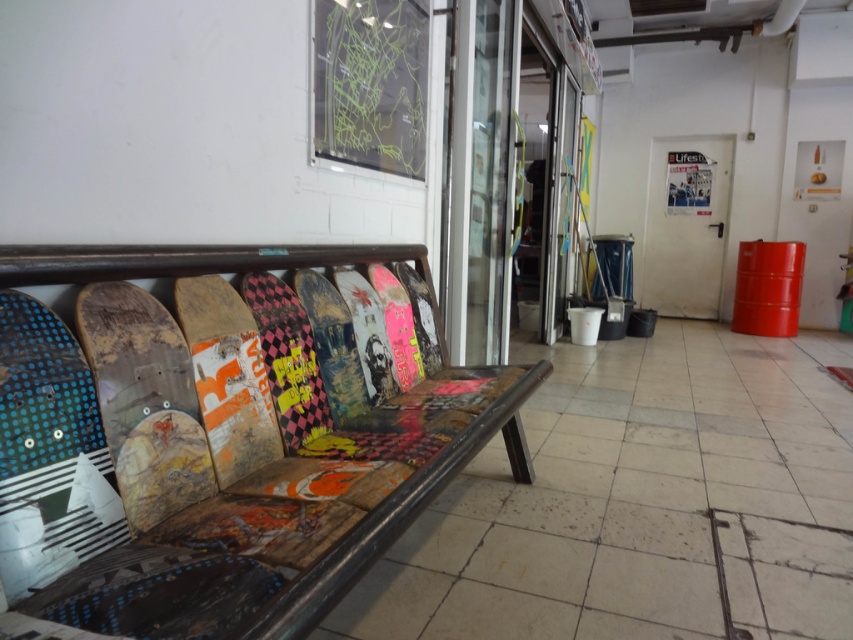
You are a customer in the shop and want to sit on the wooden skateboard bench at left. However, you notice a wooden skateboard at left nearby. Which object is bigger in size?

The wooden skateboard bench at left is larger in size compared to the wooden skateboard at left.